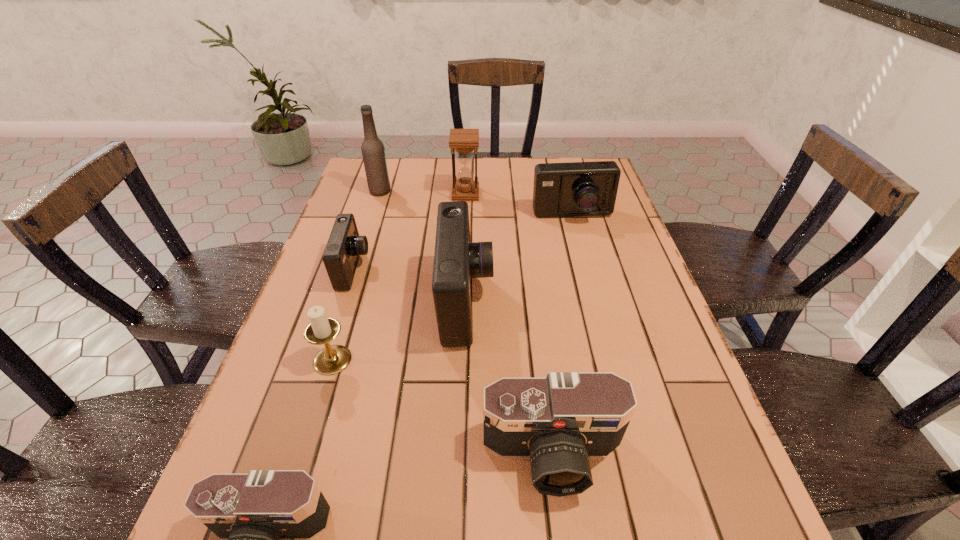
Locate an element on the screen. vacant region located 0.260m on the left of the hourglass is located at coordinates (372, 194).

This screenshot has height=540, width=960. In order to click on free space located 0.260m on the front-facing side of the tallest camera in this screenshot , I will do `click(602, 302)`.

Identify the location of free spot located on the front-facing side of the rightmost blue camera. The image size is (960, 540). (599, 314).

Identify the location of free space located on the right of the candle holder. This screenshot has height=540, width=960. (437, 360).

Image resolution: width=960 pixels, height=540 pixels. I want to click on vacant area located 0.300m on the front-facing side of the smallest blue camera, so click(485, 269).

The image size is (960, 540). Identify the location of beer bottle at the far edge. (373, 152).

The height and width of the screenshot is (540, 960). What are the coordinates of `hourglass situated at the far edge` in the screenshot? It's located at (464, 141).

This screenshot has height=540, width=960. I want to click on beer bottle situated at the left edge, so click(x=373, y=152).

The width and height of the screenshot is (960, 540). What are the coordinates of `candle holder that is positioned at the left edge` in the screenshot? It's located at (332, 359).

Locate an element on the screen. camera situated at the left edge is located at coordinates (344, 246).